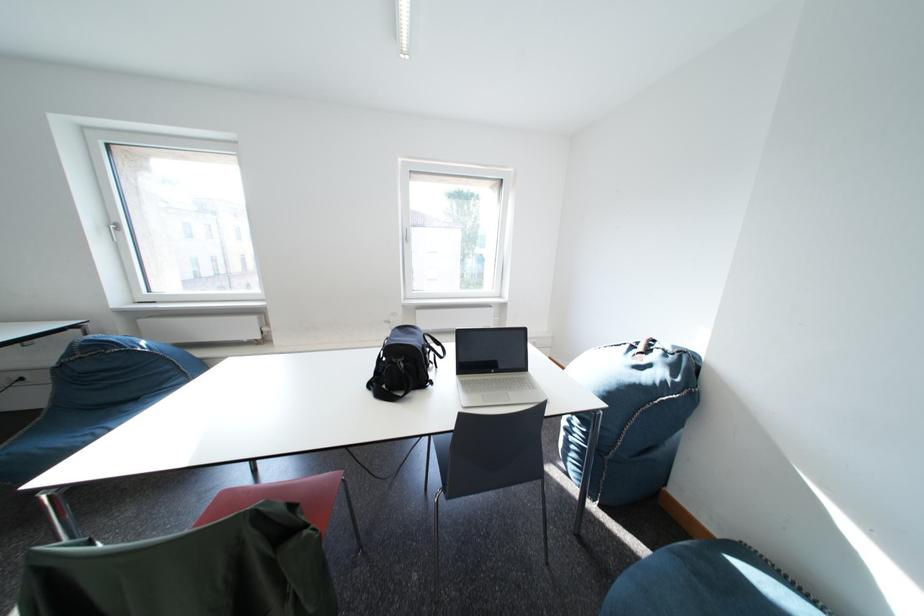
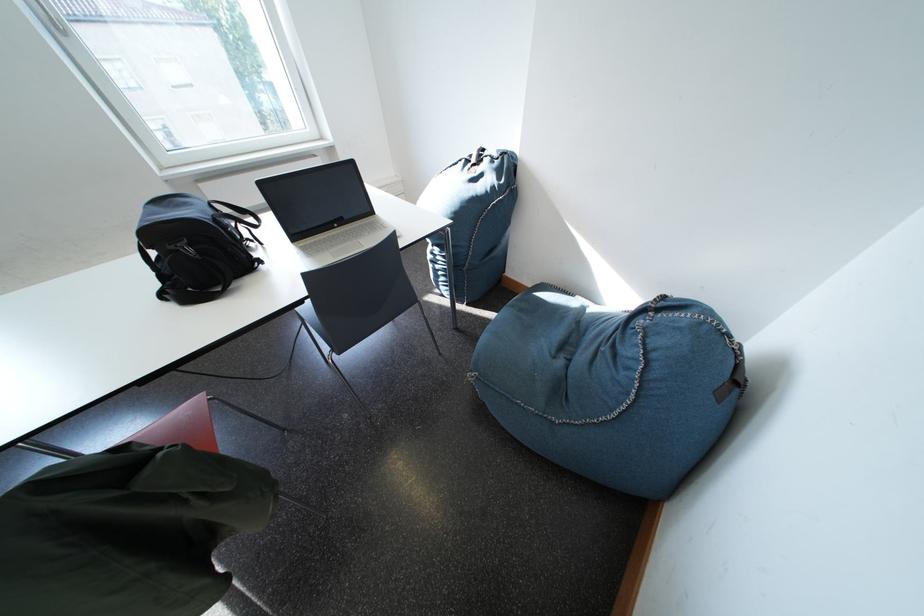
In the second image, find the point that corresponds to (431,345) in the first image.

(214, 216)